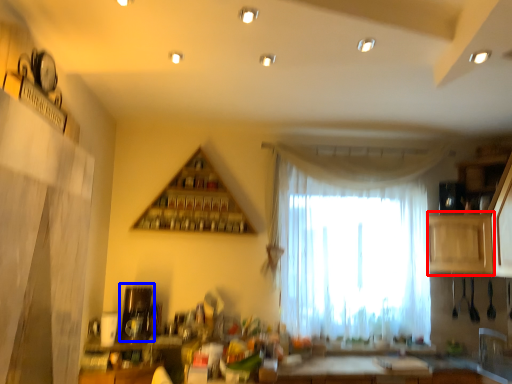
Question: Which object appears closest to the camera in this image, cabinetry (highlighted by a red box) or appliance (highlighted by a blue box)?

Choices:
 (A) cabinetry
 (B) appliance

Answer: (B)